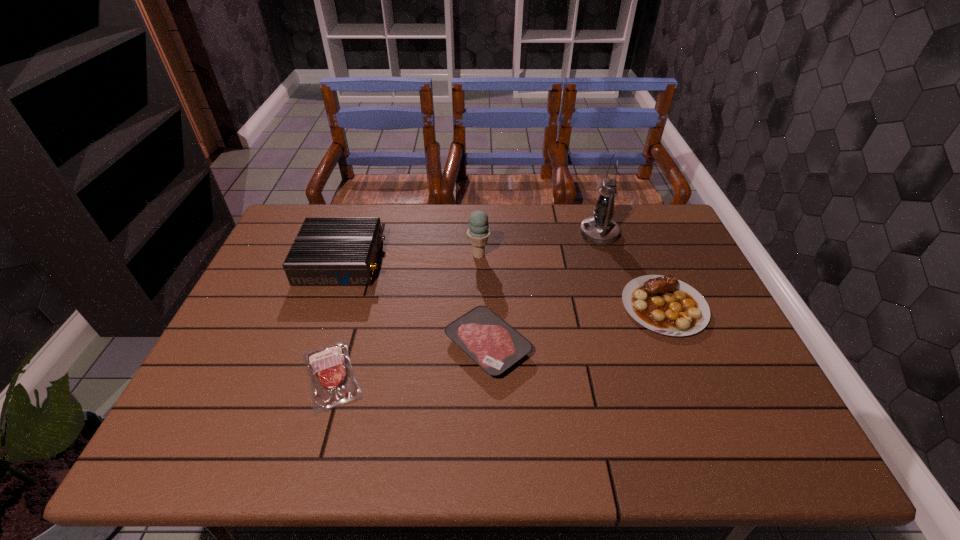
Where is `oil lamp`? oil lamp is located at coordinates (599, 229).

Where is `the second tallest object`? the second tallest object is located at coordinates (478, 232).

At what (x,y) coordinates should I click in order to perform the action: click on router. Please return your answer as a coordinate pair (x, y). Image resolution: width=960 pixels, height=540 pixels. Looking at the image, I should click on (327, 251).

What are the coordinates of `the tallest steak` in the screenshot? It's located at (664, 304).

The image size is (960, 540). What are the coordinates of `the third shortest object` in the screenshot? It's located at (664, 304).

You are a GUI agent. You are given a task and a screenshot of the screen. Output one action in this format:
    pyautogui.click(x=<x>, y=<y>)
    Task: Click on the fifth tallest object
    
    Given the screenshot: What is the action you would take?
    pyautogui.click(x=487, y=339)

What are the coordinates of `the second steak from left to right` in the screenshot? It's located at (487, 339).

Where is `the shortest object`? Image resolution: width=960 pixels, height=540 pixels. the shortest object is located at coordinates (332, 381).

At what (x,y) coordinates should I click in order to perform the action: click on the shortest steak. Please return your answer as a coordinate pair (x, y). The image size is (960, 540). Looking at the image, I should click on (332, 381).

The width and height of the screenshot is (960, 540). Identify the location of free space located 0.320m on the left of the oil lamp. (484, 233).